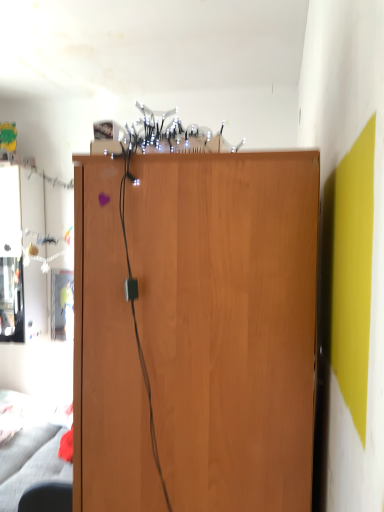
Locate an element on the screen. wooden cupboard at center is located at coordinates pos(228,322).

What is the approximate height of wooden cupboard at center?

wooden cupboard at center is 1.31 meters tall.

What do you see at coordinates (228, 322) in the screenshot?
I see `wooden cupboard at center` at bounding box center [228, 322].

I want to click on black leather swivel chair at lower left, so click(47, 497).

The height and width of the screenshot is (512, 384). What do you see at coordinates (47, 497) in the screenshot? I see `black leather swivel chair at lower left` at bounding box center [47, 497].

Locate an element on the screen. wooden cupboard at center is located at coordinates (228, 322).

Consider the image. Is wooden cupboard at center to the right of black leather swivel chair at lower left from the viewer's perspective?

Yes, wooden cupboard at center is to the right of black leather swivel chair at lower left.

Is the position of wooden cupboard at center more distant than that of black leather swivel chair at lower left?

No, wooden cupboard at center is in front of black leather swivel chair at lower left.

Considering the positions of points (189, 399) and (44, 505), is point (189, 399) closer to camera compared to point (44, 505)?

Yes, it is.

From the image's perspective, which one is positioned lower, wooden cupboard at center or black leather swivel chair at lower left?

black leather swivel chair at lower left is shown below in the image.

From a real-world perspective, is wooden cupboard at center located higher than black leather swivel chair at lower left?

Yes.

Which of these two, wooden cupboard at center or black leather swivel chair at lower left, is wider?

wooden cupboard at center.

Looking at this image, is wooden cupboard at center shorter than black leather swivel chair at lower left?

No.

Does wooden cupboard at center have a smaller size compared to black leather swivel chair at lower left?

No, wooden cupboard at center is not smaller than black leather swivel chair at lower left.

Looking at this image, is wooden cupboard at center positioned beyond the bounds of black leather swivel chair at lower left?

wooden cupboard at center is positioned outside black leather swivel chair at lower left.

In the scene shown: Is wooden cupboard at center next to black leather swivel chair at lower left?

No, wooden cupboard at center is not in contact with black leather swivel chair at lower left.

Is wooden cupboard at center facing away from black leather swivel chair at lower left?

No, wooden cupboard at center is not facing away from black leather swivel chair at lower left.

Can you tell me how much wooden cupboard at center and black leather swivel chair at lower left differ in facing direction?

wooden cupboard at center and black leather swivel chair at lower left are facing 89.4 degrees away from each other.

The height and width of the screenshot is (512, 384). What are the coordinates of `swivel chair located below the wooden cupboard at center (from the image's perspective)` in the screenshot? It's located at (47, 497).

Is black leather swivel chair at lower left to the left of wooden cupboard at center from the viewer's perspective?

Indeed, black leather swivel chair at lower left is positioned on the left side of wooden cupboard at center.

Which object is further away from the camera, black leather swivel chair at lower left or wooden cupboard at center?

Positioned behind is black leather swivel chair at lower left.

Which is behind, point (33, 489) or point (184, 226)?

The point (33, 489) is more distant.

From the image's perspective, is black leather swivel chair at lower left located above or below wooden cupboard at center?

From the image's perspective, black leather swivel chair at lower left appears below wooden cupboard at center.

From a real-world perspective, which is physically above, black leather swivel chair at lower left or wooden cupboard at center?

wooden cupboard at center.

Considering the relative sizes of black leather swivel chair at lower left and wooden cupboard at center in the image provided, is black leather swivel chair at lower left thinner than wooden cupboard at center?

Yes.

Which of these two, black leather swivel chair at lower left or wooden cupboard at center, stands shorter?

Standing shorter between the two is black leather swivel chair at lower left.

Considering the sizes of objects black leather swivel chair at lower left and wooden cupboard at center in the image provided, who is smaller, black leather swivel chair at lower left or wooden cupboard at center?

black leather swivel chair at lower left.

Would you say black leather swivel chair at lower left contains wooden cupboard at center?

Definitely not — wooden cupboard at center is not inside black leather swivel chair at lower left.

Is black leather swivel chair at lower left with wooden cupboard at center?

black leather swivel chair at lower left and wooden cupboard at center are not in contact.

Is black leather swivel chair at lower left oriented towards wooden cupboard at center?

No, black leather swivel chair at lower left is not oriented towards wooden cupboard at center.

What's the angular difference between black leather swivel chair at lower left and wooden cupboard at center's facing directions?

The facing directions of black leather swivel chair at lower left and wooden cupboard at center are 89.4 degrees apart.

Identify the location of swivel chair below the wooden cupboard at center (from the image's perspective). The height and width of the screenshot is (512, 384). (47, 497).

I want to click on swivel chair located on the left of wooden cupboard at center, so click(x=47, y=497).

Where is `cupboard that is above the black leather swivel chair at lower left (from a real-world perspective)`? cupboard that is above the black leather swivel chair at lower left (from a real-world perspective) is located at coordinates [228, 322].